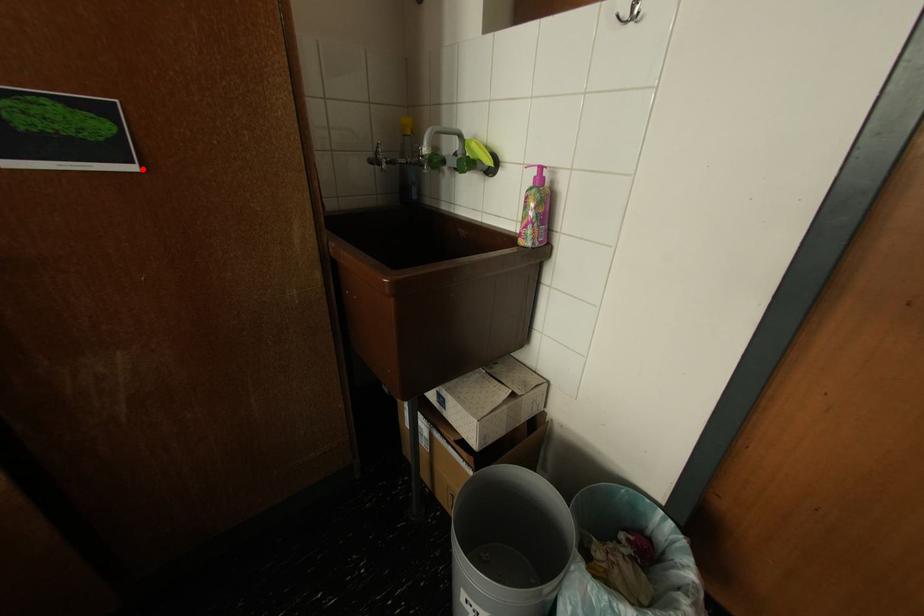
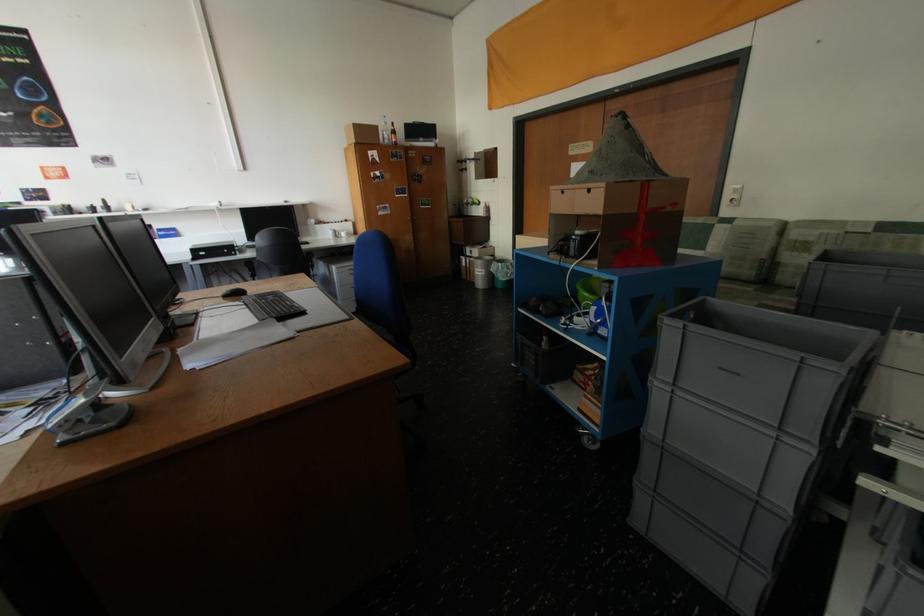
Locate, in the second image, the point that corresponds to the highlighted location in the first image.

(439, 208)